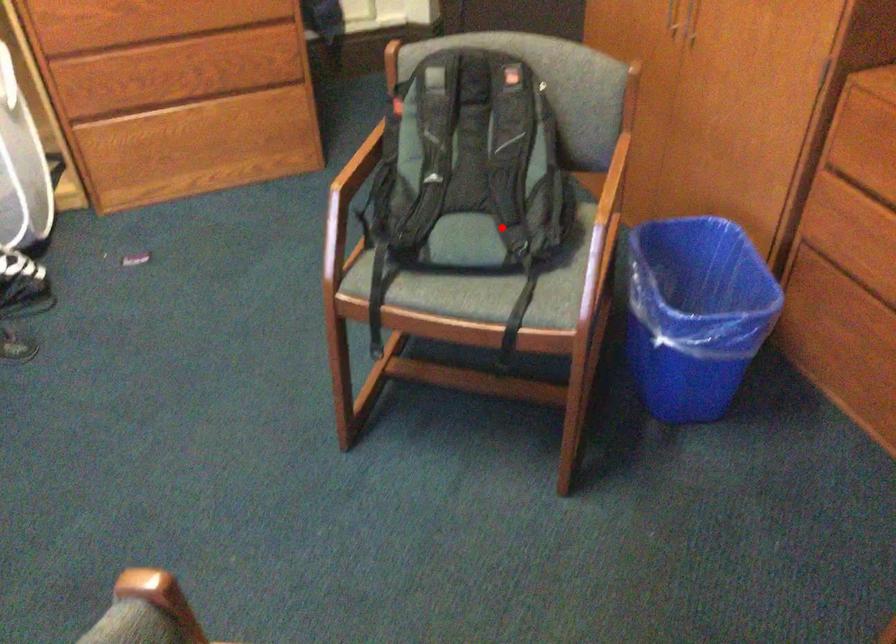
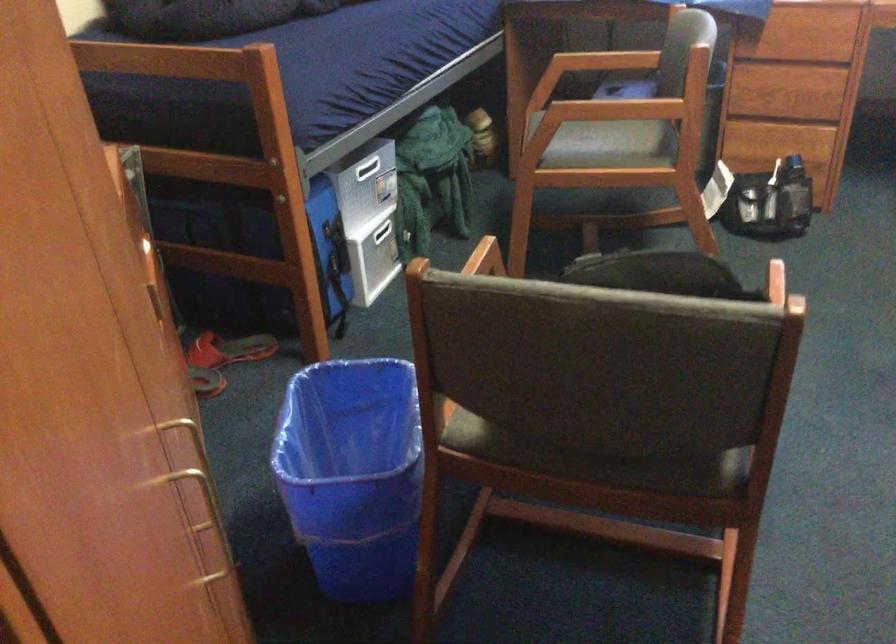
Find the pixel in the second image that matches the highlighted location in the first image.

(561, 460)